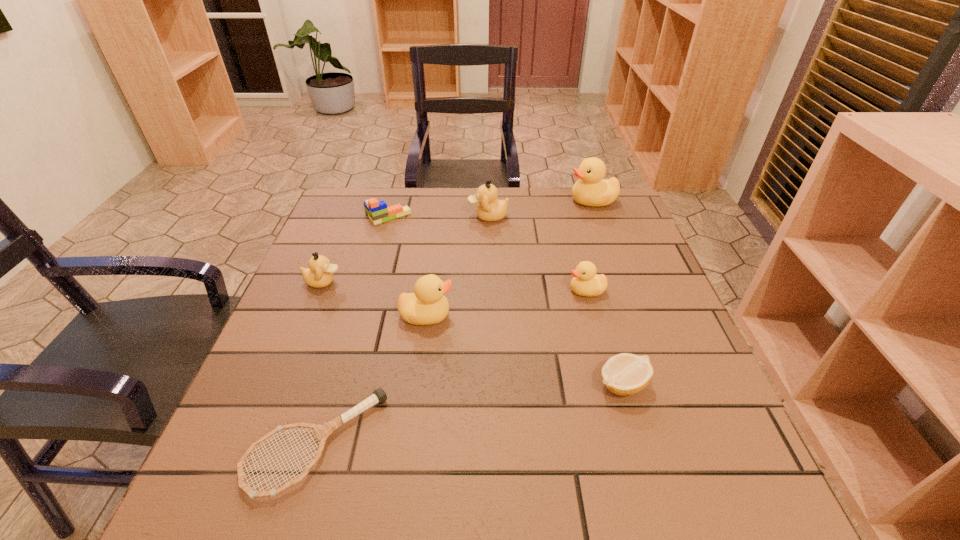
Locate an element on the screen. The height and width of the screenshot is (540, 960). yellow lemon is located at coordinates (624, 374).

Find the location of a particular element. the second shortest object is located at coordinates (624, 374).

Where is `the shortest object`? The height and width of the screenshot is (540, 960). the shortest object is located at coordinates (322, 431).

At what (x,y) coordinates should I click in order to perform the action: click on gray tennis racket. Please return your answer as a coordinate pair (x, y). The height and width of the screenshot is (540, 960). Looking at the image, I should click on (322, 431).

Image resolution: width=960 pixels, height=540 pixels. I want to click on vacant space positioned on the face of the farthest yellow duckling, so click(536, 201).

At what (x,y) coordinates should I click in order to perform the action: click on free space located on the face of the farthest yellow duckling. Please return your answer as a coordinate pair (x, y). This screenshot has height=540, width=960. Looking at the image, I should click on (522, 201).

Locate an element on the screen. vacant region located on the face of the farthest yellow duckling is located at coordinates (487, 201).

Locate an element on the screen. The width and height of the screenshot is (960, 540). free location located 0.140m on the face of the third duckling from right to left is located at coordinates (420, 217).

At what (x,y) coordinates should I click in order to perform the action: click on vacant position located on the face of the third duckling from right to left. Please return your answer as a coordinate pair (x, y). Looking at the image, I should click on (372, 217).

Locate an element on the screen. The height and width of the screenshot is (540, 960). free space located 0.280m on the face of the third duckling from right to left is located at coordinates (372, 217).